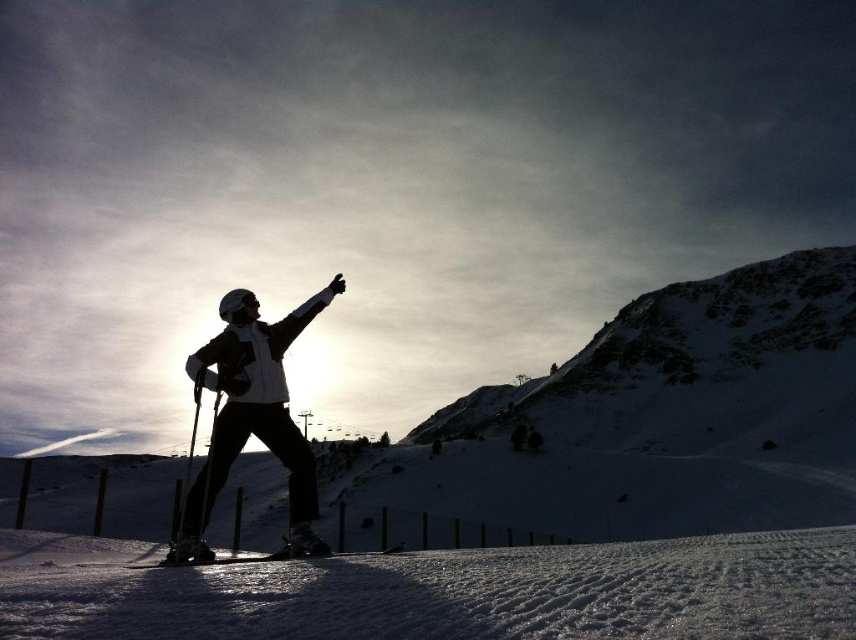
Question: Does matte white jacket at center appear on the left side of shiny metallic ski at center?

Choices:
 (A) no
 (B) yes

Answer: (B)

Question: Is white snow at lower center positioned at the back of matte white jacket at center?

Choices:
 (A) yes
 (B) no

Answer: (B)

Question: Which object appears farthest from the camera in this image?

Choices:
 (A) shiny metallic ski at center
 (B) white snow at lower center
 (C) matte white jacket at center

Answer: (C)

Question: Which object is farther from the camera taking this photo?

Choices:
 (A) matte white jacket at center
 (B) shiny metallic ski at center

Answer: (A)

Question: Can you confirm if white snow at lower center is positioned above matte white jacket at center?

Choices:
 (A) yes
 (B) no

Answer: (B)

Question: Which object appears closest to the camera in this image?

Choices:
 (A) matte white jacket at center
 (B) shiny metallic ski at center
 (C) white snow at lower center

Answer: (C)